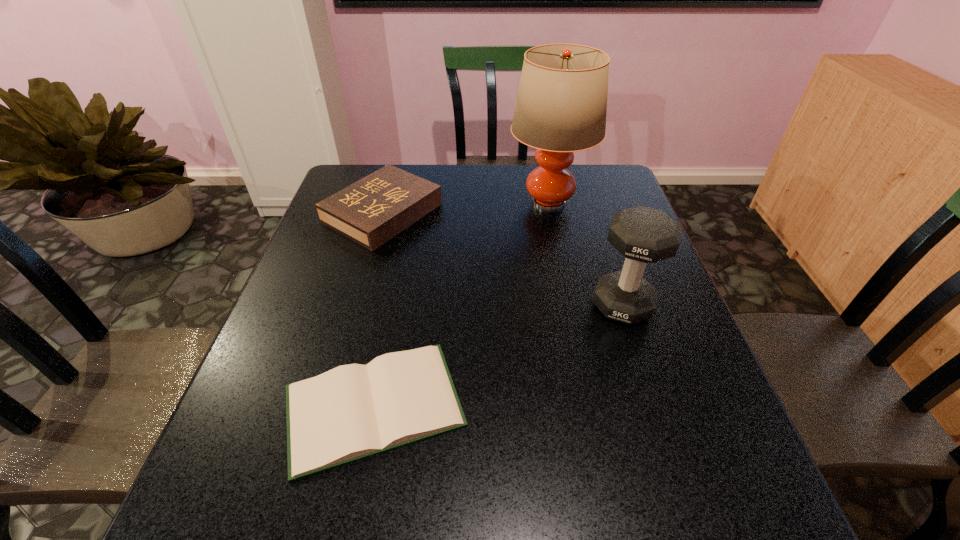
In the image, there is a desktop. Where is `vacant space at the near edge`? vacant space at the near edge is located at coordinates (498, 508).

In the image, there is a desktop. Where is `blank space at the left edge`? The height and width of the screenshot is (540, 960). blank space at the left edge is located at coordinates (286, 294).

Where is `vacant space at the right edge`? The height and width of the screenshot is (540, 960). vacant space at the right edge is located at coordinates (714, 464).

Identify the location of vacant area that lies between the farther hardback book and the second tallest object. The width and height of the screenshot is (960, 540). (502, 259).

In order to click on vacant region between the dumbbell and the shorter hardback book in this screenshot , I will do `click(498, 356)`.

Identify the location of vacant space that is in between the nearest object and the second shortest object. (378, 309).

You are a GUI agent. You are given a task and a screenshot of the screen. Output one action in this format:
    pyautogui.click(x=<x>, y=<y>)
    Task: Click on the vacant region between the taller hardback book and the dumbbell
    
    Given the screenshot: What is the action you would take?
    pyautogui.click(x=502, y=259)

You are a GUI agent. You are given a task and a screenshot of the screen. Output one action in this format:
    pyautogui.click(x=<x>, y=<y>)
    Task: Click on the unoccupied position between the dumbbell and the third tallest object
    Image resolution: width=960 pixels, height=540 pixels.
    Given the screenshot: What is the action you would take?
    pyautogui.click(x=502, y=259)

Locate an element on the screen. free space that is in between the nearest object and the farther hardback book is located at coordinates point(378,309).

Locate an element on the screen. empty space that is in between the third shortest object and the nearer hardback book is located at coordinates (498, 356).